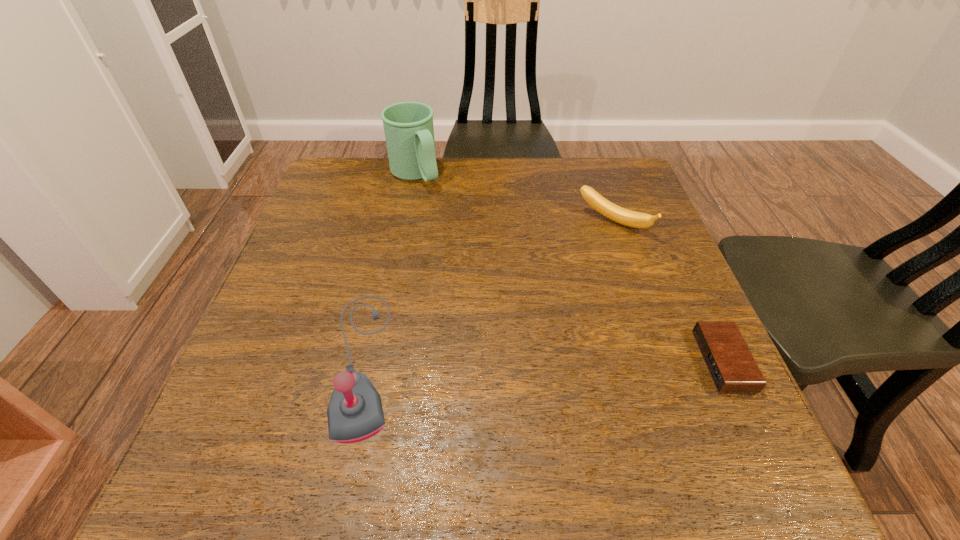
Image resolution: width=960 pixels, height=540 pixels. Find the location of `joystick`. joystick is located at coordinates (355, 413).

Locate an element on the screen. The width and height of the screenshot is (960, 540). the shortest object is located at coordinates (729, 361).

Locate an element on the screen. This screenshot has height=540, width=960. the tallest object is located at coordinates (409, 132).

This screenshot has width=960, height=540. What are the coordinates of `mug` in the screenshot? It's located at click(409, 132).

Identify the location of the second shortest object. This screenshot has height=540, width=960. (623, 216).

Where is `banana`? banana is located at coordinates (623, 216).

You are a GUI agent. You are given a task and a screenshot of the screen. Output one action in this format:
    pyautogui.click(x=<x>, y=<y>)
    Task: Click on the vacant area located on the right of the joystick
    This screenshot has height=540, width=960.
    Given the screenshot: What is the action you would take?
    pyautogui.click(x=610, y=361)

Find the location of a particular element. The image size is (960, 540). free space located 0.310m on the front face of the alarm clock is located at coordinates (536, 361).

Locate an element on the screen. The image size is (960, 540). free space located on the front face of the alarm clock is located at coordinates (650, 361).

The width and height of the screenshot is (960, 540). Find the location of `free space located on the front face of the alarm clock`. free space located on the front face of the alarm clock is located at coordinates point(487,361).